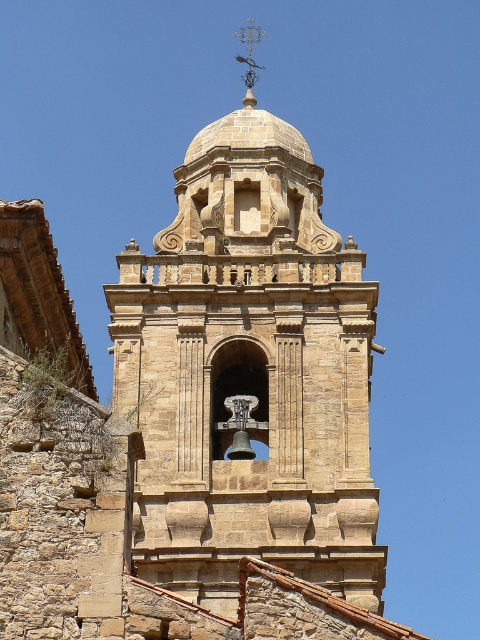
Does brown stone bell tower at center appear on the right side of metallic weather vane at upper center?

In fact, brown stone bell tower at center is to the left of metallic weather vane at upper center.

Who is more forward, (291, 461) or (243, 33)?

Point (291, 461)

Where is `brown stone bell tower at center`? The width and height of the screenshot is (480, 640). brown stone bell tower at center is located at coordinates (249, 374).